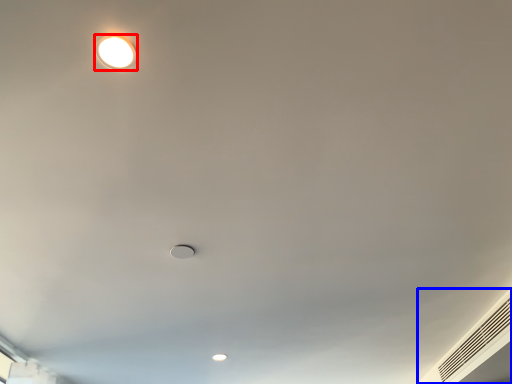
Question: Which point is further to the camera, lamp (highlighted by a red box) or air conditioning (highlighted by a blue box)?

Choices:
 (A) lamp
 (B) air conditioning

Answer: (B)